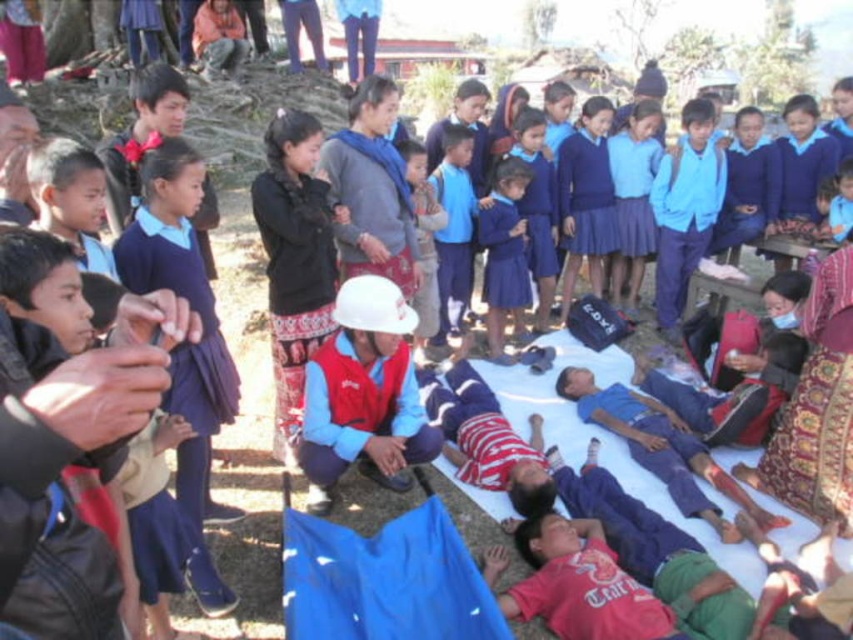
Can you confirm if blue fabric skirt at center is smaller than white matte helmet at center?

No.

Does point (512, 228) lie behind point (402, 147)?

Yes.

I want to click on blue fabric skirt at center, so click(x=503, y=253).